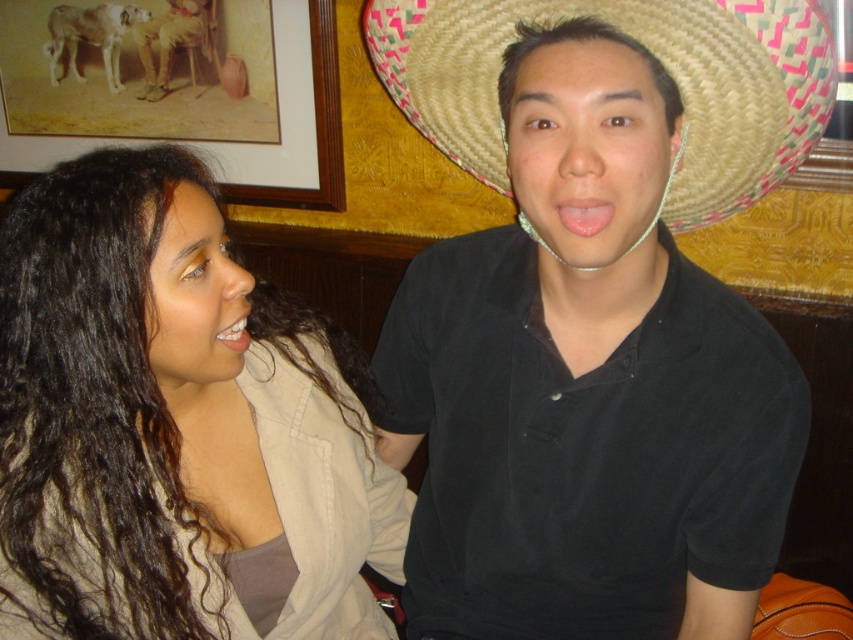
Between black matte shirt at center and brown leather boots at upper left, which one has less height?

With less height is brown leather boots at upper left.

Between point (734, 561) and point (189, 20), which one is positioned in front?

Positioned in front is point (734, 561).

Where is `black matte shirt at center`? This screenshot has width=853, height=640. black matte shirt at center is located at coordinates (589, 324).

What do you see at coordinates (589, 324) in the screenshot? I see `black matte shirt at center` at bounding box center [589, 324].

How far apart are black matte shirt at center and wooden framed picture at upper left?

black matte shirt at center is 38.44 inches from wooden framed picture at upper left.

The image size is (853, 640). What are the coordinates of `black matte shirt at center` in the screenshot? It's located at (589, 324).

The width and height of the screenshot is (853, 640). What are the coordinates of `black matte shirt at center` in the screenshot? It's located at (589, 324).

The width and height of the screenshot is (853, 640). What do you see at coordinates (175, 426) in the screenshot? I see `dark brown curly hair at left` at bounding box center [175, 426].

Is point (363, 545) farther from camera compared to point (16, 179)?

That is False.

Image resolution: width=853 pixels, height=640 pixels. What do you see at coordinates (175, 426) in the screenshot?
I see `dark brown curly hair at left` at bounding box center [175, 426].

Find the location of `dark brown curly hair at left`. dark brown curly hair at left is located at coordinates (175, 426).